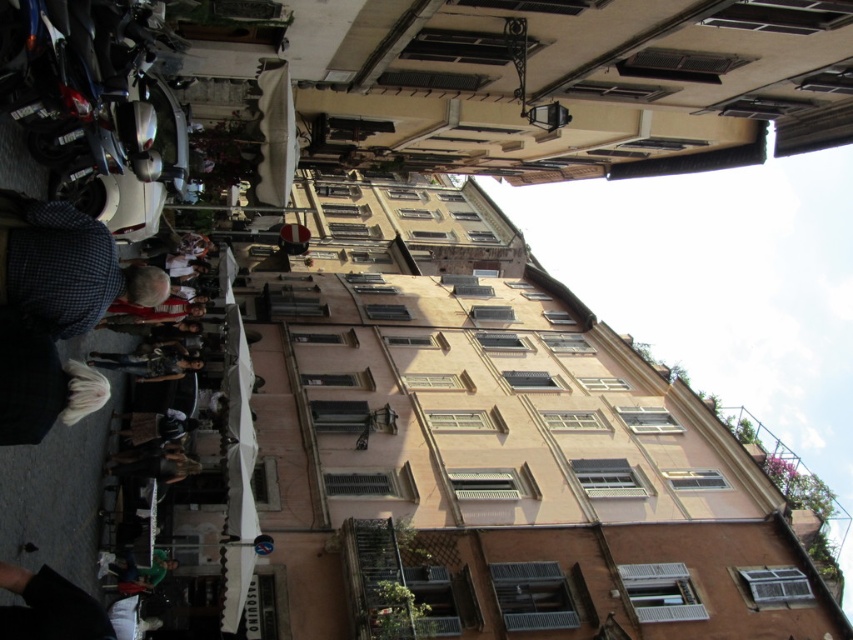
You are a photographer standing in the middle of the street, and you want to capture both the point at coordinates point (16, 220) and point (149, 577) in your photo. Which point should you focus on first to ensure both are in sharp focus?

You should focus on point (16, 220) first because it is closer to the camera than point (149, 577). This ensures the closer point is in focus, and with proper depth of field, the farther point may also be sharp.

You are a photographer trying to capture both the checkered fabric shirt at left and the green fabric shirt at lower left in a single frame. Which shirt should you focus on first to ensure both are in the frame?

The checkered fabric shirt at left is smaller than the green fabric shirt at lower left, so you should focus on the checkered fabric shirt at left first to ensure both are in the frame.